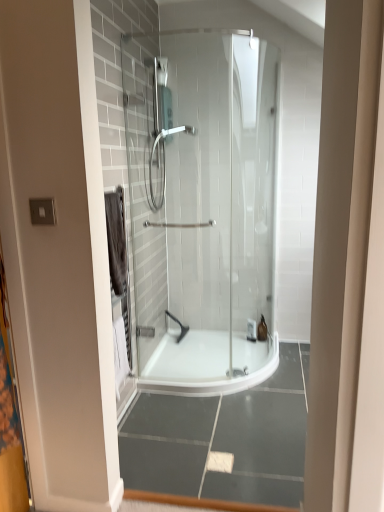
Question: From a real-world perspective, is matte silver shower head at center, which is the 1th shower from front to back, physically below black rubber showerhead at center, which ranks as the 2th shower in front-to-back order?

Choices:
 (A) yes
 (B) no

Answer: (B)

Question: Can you confirm if matte silver shower head at center, arranged as the second shower when ordered from the bottom, is positioned to the left of black rubber showerhead at center, which ranks as the 2th shower in front-to-back order?

Choices:
 (A) no
 (B) yes

Answer: (B)

Question: Is matte silver shower head at center, the 1th shower when ordered from top to bottom, facing away from black rubber showerhead at center, the first shower from the back?

Choices:
 (A) no
 (B) yes

Answer: (A)

Question: Would you say matte silver shower head at center, which is the 1th shower from front to back, contains black rubber showerhead at center, which is counted as the first shower, starting from the bottom?

Choices:
 (A) yes
 (B) no

Answer: (B)

Question: Is matte silver shower head at center, which is the 1th shower from front to back, next to black rubber showerhead at center, which ranks as the 2th shower in front-to-back order, and touching it?

Choices:
 (A) yes
 (B) no

Answer: (B)

Question: In terms of height, does translucent glass toiletry at center, the 1th toiletry when ordered from right to left, look taller or shorter compared to white plastic bottle at center, arranged as the 2th toiletry when viewed from the right?

Choices:
 (A) tall
 (B) short

Answer: (A)

Question: Considering the positions of translucent glass toiletry at center, which ranks as the second toiletry in left-to-right order, and white plastic bottle at center, arranged as the 2th toiletry when viewed from the right, in the image, is translucent glass toiletry at center, which ranks as the second toiletry in left-to-right order, bigger or smaller than white plastic bottle at center, arranged as the 2th toiletry when viewed from the right,?

Choices:
 (A) big
 (B) small

Answer: (A)

Question: Is translucent glass toiletry at center, which ranks as the second toiletry in left-to-right order, inside the boundaries of white plastic bottle at center, which is the first toiletry from left to right, or outside?

Choices:
 (A) outside
 (B) inside

Answer: (A)

Question: Visually, is translucent glass toiletry at center, the 1th toiletry when ordered from right to left, positioned to the left or to the right of white plastic bottle at center, which is the first toiletry from left to right?

Choices:
 (A) left
 (B) right

Answer: (B)

Question: Is translucent glass toiletry at center, which ranks as the second toiletry in left-to-right order, bigger or smaller than matte silver shower head at center, arranged as the second shower when ordered from the bottom?

Choices:
 (A) big
 (B) small

Answer: (B)

Question: In terms of height, does translucent glass toiletry at center, which ranks as the second toiletry in left-to-right order, look taller or shorter compared to matte silver shower head at center, the 1th shower when ordered from top to bottom?

Choices:
 (A) short
 (B) tall

Answer: (A)

Question: Which is correct: translucent glass toiletry at center, which ranks as the second toiletry in left-to-right order, is inside matte silver shower head at center, marked as the 2th shower in a back-to-front arrangement, or outside of it?

Choices:
 (A) outside
 (B) inside

Answer: (A)

Question: From a real-world perspective, is translucent glass toiletry at center, the 1th toiletry when ordered from right to left, physically located above or below matte silver shower head at center, the 1th shower when ordered from top to bottom?

Choices:
 (A) below
 (B) above

Answer: (A)

Question: Considering the positions of translucent glass toiletry at center, which ranks as the second toiletry in left-to-right order, and black rubber showerhead at center, which ranks as the 2th shower in front-to-back order, in the image, is translucent glass toiletry at center, which ranks as the second toiletry in left-to-right order, bigger or smaller than black rubber showerhead at center, which ranks as the 2th shower in front-to-back order,?

Choices:
 (A) big
 (B) small

Answer: (B)

Question: Is translucent glass toiletry at center, which ranks as the second toiletry in left-to-right order, taller or shorter than black rubber showerhead at center, which is counted as the first shower, starting from the bottom?

Choices:
 (A) tall
 (B) short

Answer: (A)